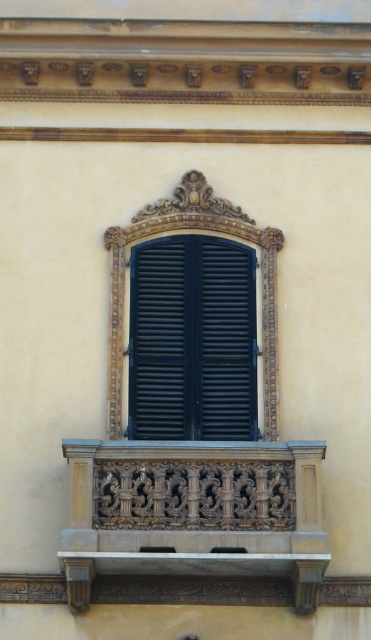
In the scene shown: Does carved wood balcony at lower center lie behind matte black shutters at center?

No, it is in front of matte black shutters at center.

Does carved wood balcony at lower center appear under matte black shutters at center?

Correct, carved wood balcony at lower center is located below matte black shutters at center.

Image resolution: width=371 pixels, height=640 pixels. Find the location of `carved wood balcony at lower center`. carved wood balcony at lower center is located at coordinates (194, 513).

Where is `carved wood balcony at lower center`? carved wood balcony at lower center is located at coordinates (194, 513).